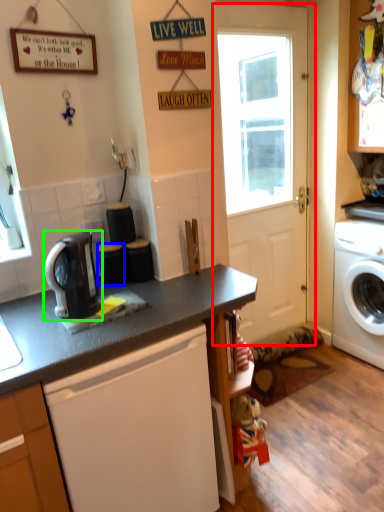
Question: Which is farther away from door (highlighted by a red box)? appliance (highlighted by a blue box) or kitchen appliance (highlighted by a green box)?

Choices:
 (A) appliance
 (B) kitchen appliance

Answer: (B)